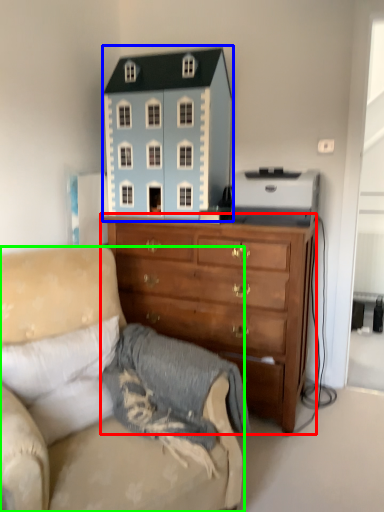
Question: Based on their relative distances, which object is nearer to chest of drawers (highlighted by a red box)? Choose from toy (highlighted by a blue box) and studio couch (highlighted by a green box).

Choices:
 (A) toy
 (B) studio couch

Answer: (A)